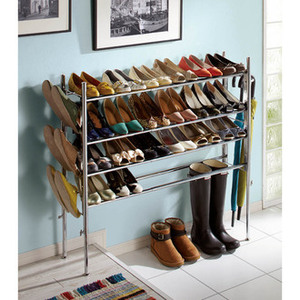
This screenshot has height=300, width=300. What are the coordinates of `pairs of shoes on top shelf` in the screenshot? It's located at (226, 65), (204, 68), (178, 73), (154, 76), (129, 84), (97, 87).